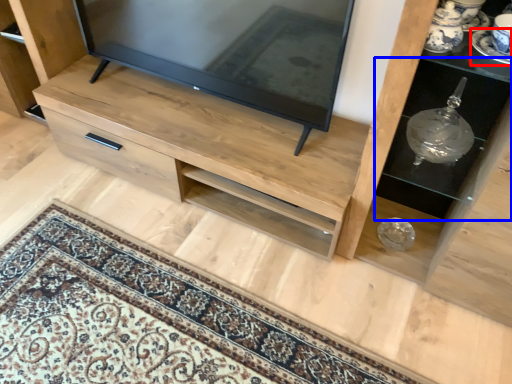
Question: Among these objects, which one is nearest to the camera, saucer (highlighted by a red box) or shelf (highlighted by a blue box)?

Choices:
 (A) saucer
 (B) shelf

Answer: (A)